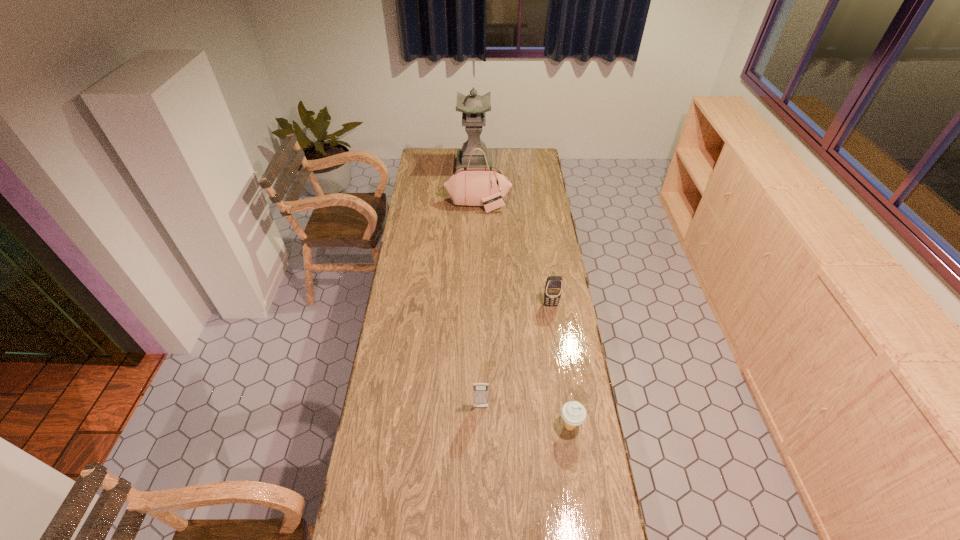
I want to click on unoccupied area between the tallest object and the nearer cellular telephone, so click(477, 287).

Find the location of `free area in between the third farthest object and the tallest object`. free area in between the third farthest object and the tallest object is located at coordinates (513, 235).

I want to click on vacant point located between the tallest object and the nearer cellular telephone, so click(x=477, y=287).

Identify the location of vacant area between the farthest object and the nearest object. This screenshot has height=540, width=960. (522, 297).

The width and height of the screenshot is (960, 540). In order to click on vacant point located between the handbag and the third nearest object in this screenshot , I will do `click(515, 254)`.

Identify the location of the second closest object to the handbag. Image resolution: width=960 pixels, height=540 pixels. (553, 288).

The image size is (960, 540). What are the coordinates of `object that stands as the closest to the sculpture` in the screenshot? It's located at (473, 186).

The width and height of the screenshot is (960, 540). What are the coordinates of `cellular telephone that can be found as the second closest to the nearest object` in the screenshot? It's located at point(553,288).

Where is `the second closest cellular telephone relative to the icecream`? the second closest cellular telephone relative to the icecream is located at coordinates point(553,288).

Find the location of a particular element. free space that satisfies the following two spatial constraints: 1. on the side of the handbag with the attached pouch; 2. on the left side of the nearest object is located at coordinates (477, 427).